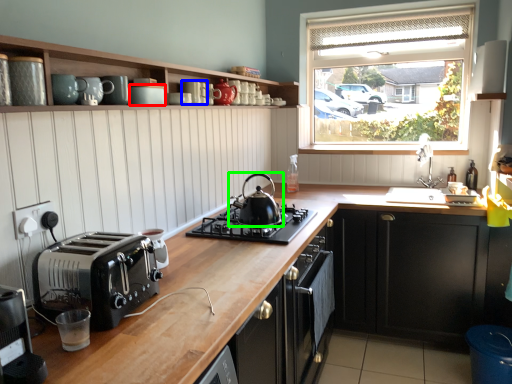
Question: Which is nearer to the appliance (highlighted by a red box)? appliance (highlighted by a blue box) or kitchen appliance (highlighted by a green box).

Choices:
 (A) appliance
 (B) kitchen appliance

Answer: (A)